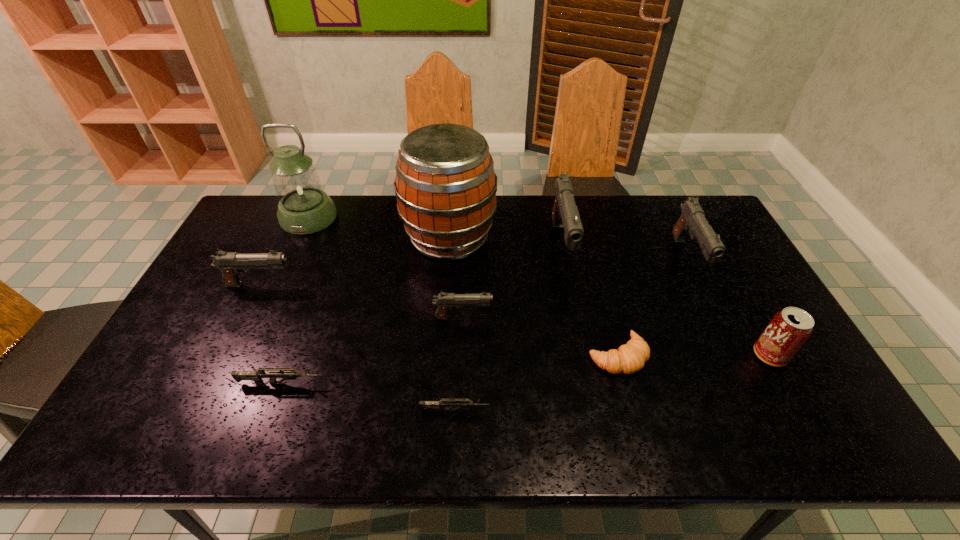
The width and height of the screenshot is (960, 540). What are the coordinates of `object that ranks as the fourth closest to the greenish lantern` in the screenshot? It's located at (256, 376).

At what (x,y) coordinates should I click in order to perform the action: click on gun that is the fifth closest to the eighth shortest object. Please return your answer as a coordinate pair (x, y). Looking at the image, I should click on pyautogui.click(x=231, y=264).

Identify which gun is the fifth nearest to the farther grey gun. Please provide its 2D coordinates. Your answer should be formatted as a tuple, i.e. [(x, y)], where the tuple contains the x and y coordinates of a point satisfying the conditions above.

[(692, 220)]

Where is `gray gun that stands as the closest to the shortest object`? The image size is (960, 540). gray gun that stands as the closest to the shortest object is located at coordinates (445, 301).

Select which gray gun appears as the third closest to the third gray gun from right to left. Please provide its 2D coordinates. Your answer should be formatted as a tuple, i.e. [(x, y)], where the tuple contains the x and y coordinates of a point satisfying the conditions above.

[(692, 220)]

Where is `vacant space that satisfies the following two spatial constraints: 1. in the direction the second biggest gray gun is aimed; 2. on the left side of the rightmost object`? This screenshot has height=540, width=960. vacant space that satisfies the following two spatial constraints: 1. in the direction the second biggest gray gun is aimed; 2. on the left side of the rightmost object is located at coordinates (736, 355).

You are a GUI agent. You are given a task and a screenshot of the screen. Output one action in this format:
    pyautogui.click(x=<x>, y=<y>)
    Task: Click on the free space that satisfies the following two spatial constraints: 1. in the direction the soda can is aimed; 2. on the left side of the third tallest gun
    
    Given the screenshot: What is the action you would take?
    [x=226, y=355]

I want to click on free point that satisfies the following two spatial constraints: 1. in the direction the second biggest gray gun is aimed; 2. in the direction the sixth farthest object is aimed, so click(717, 318).